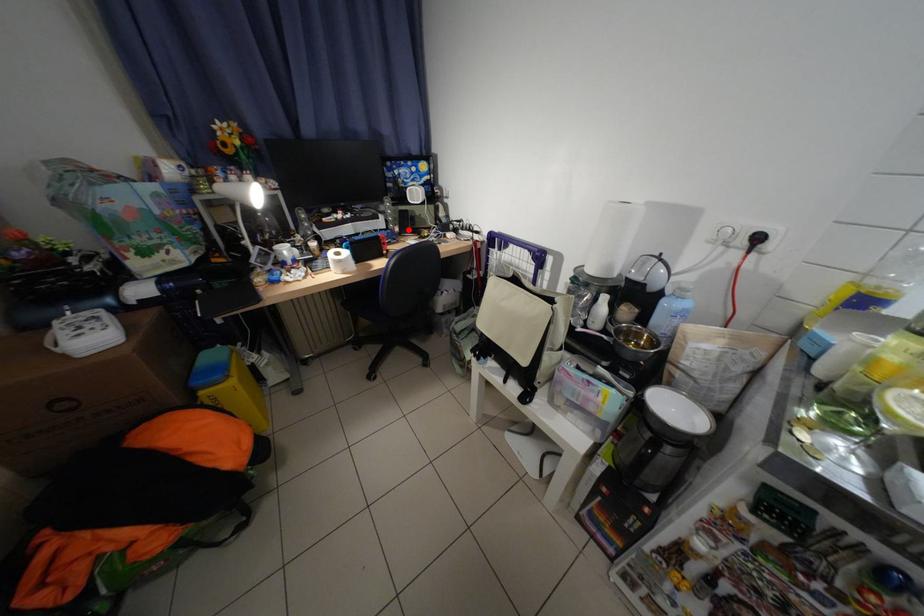
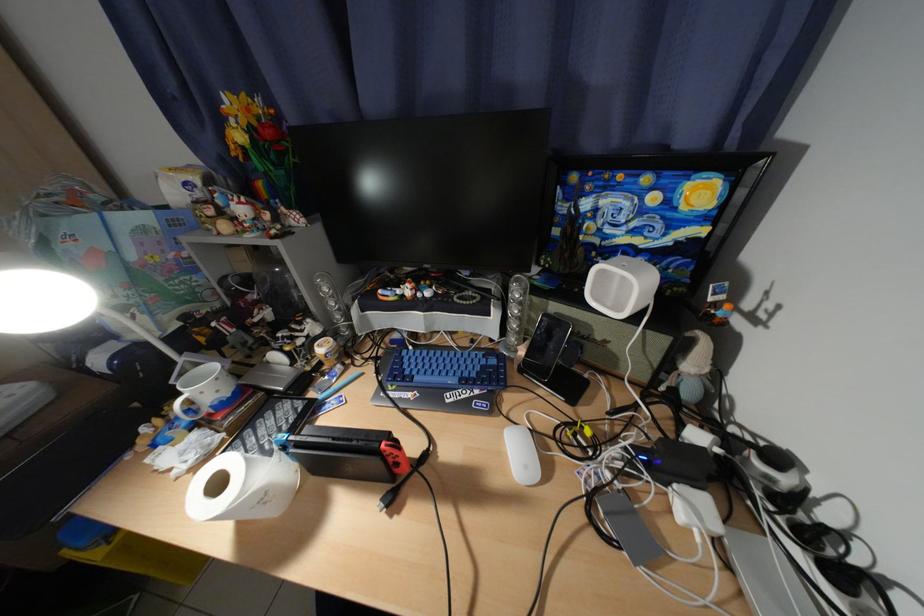
Locate, in the second image, the point that corresponds to the highlighted location in the first image.

(533, 354)